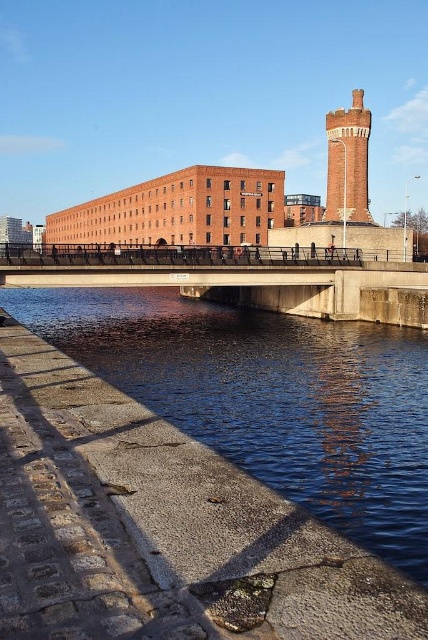
You are a city planner assessing the waterfront area. You need to determine if the blue concrete river at lower left can accommodate a new boat that requires a channel twice the size of the concrete bridge at center. Based on the scene description, can the river support this new boat?

The blue concrete river at lower left is bigger than the concrete bridge at center. Since the boat requires a channel twice the size of the bridge, and the river is already larger than the bridge, it might be possible. However, without exact measurements, we cannot confirm if it meets the exact requirement. Further assessment is needed.

You are standing on the walkway and want to take a photo of the red brick tower at upper right and the concrete bridge at center. Which object should you position to your left to include both in the frame?

You should position the concrete bridge at center to your left since it is already to the left of the red brick tower at upper right, allowing both to be captured in the photo frame.

You are standing at the point with coordinates point (369,115) and want to walk to the bridge. Which direction should you go relative to point (339,296)?

You should walk towards point (339,296) because it is in front of point (369,115), so moving towards it would lead you toward the bridge.